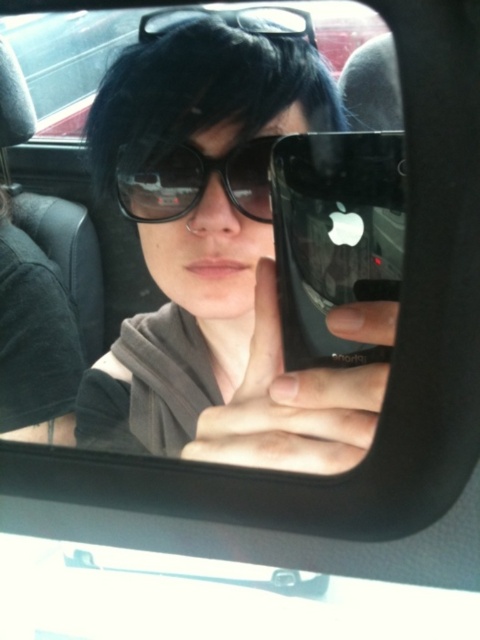
Question: Considering the real-world distances, which object is farthest from the dark gray fabric at left?

Choices:
 (A) black glossy phone at center
 (B) matte black sunglasses at center

Answer: (A)

Question: Can you confirm if dark gray fabric at left is bigger than black plastic sunglasses at center?

Choices:
 (A) yes
 (B) no

Answer: (A)

Question: Estimate the real-world distances between objects in this image. Which object is farther from the black glossy phone at center?

Choices:
 (A) matte black sunglasses at center
 (B) black plastic sunglasses at center

Answer: (A)

Question: Does black plastic sunglasses at center appear under black matte sunglasses at upper center?

Choices:
 (A) yes
 (B) no

Answer: (A)

Question: Among these objects, which one is nearest to the camera?

Choices:
 (A) black plastic sunglasses at center
 (B) matte black sunglasses at center
 (C) black matte sunglasses at upper center
 (D) black glossy phone at center

Answer: (B)

Question: Is black plastic sunglasses at center thinner than black matte sunglasses at upper center?

Choices:
 (A) yes
 (B) no

Answer: (A)